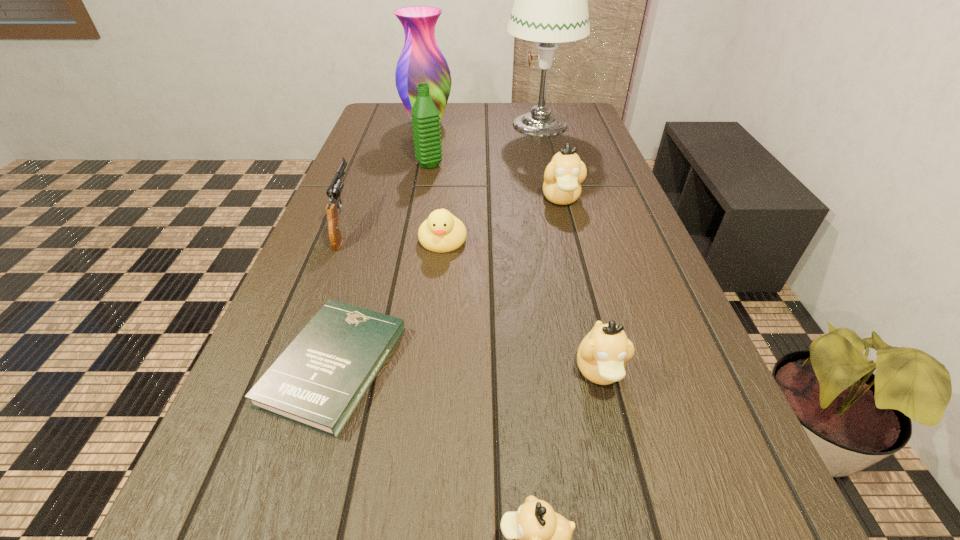
At what (x,y) coordinates should I click in order to perform the action: click on book that is at the left edge. Please return your answer as a coordinate pair (x, y). Looking at the image, I should click on (318, 381).

Find the location of a particular element. lampshade present at the right edge is located at coordinates (550, 6).

This screenshot has height=540, width=960. In order to click on object present at the far left corner in this screenshot , I will do `click(421, 61)`.

Where is `object at the far right corner`? The image size is (960, 540). object at the far right corner is located at coordinates (550, 6).

Locate an element on the screen. The image size is (960, 540). blank space at the left edge is located at coordinates (369, 167).

The height and width of the screenshot is (540, 960). Identify the location of vacant region at the right edge of the desktop. (660, 264).

This screenshot has width=960, height=540. In the image, there is a desktop. What are the coordinates of `vacant space at the far right corner` in the screenshot? It's located at (581, 113).

Identify the location of vacant point located between the third nearest duckling and the farthest tan duckling. (502, 219).

At what (x,y) coordinates should I click in order to perform the action: click on unoccupied area between the second farthest tan duckling and the tallest duckling. Please return your answer as a coordinate pair (x, y). Looking at the image, I should click on (581, 285).

Where is `vacant area between the lampshade and the vase`? vacant area between the lampshade and the vase is located at coordinates pyautogui.click(x=483, y=124).